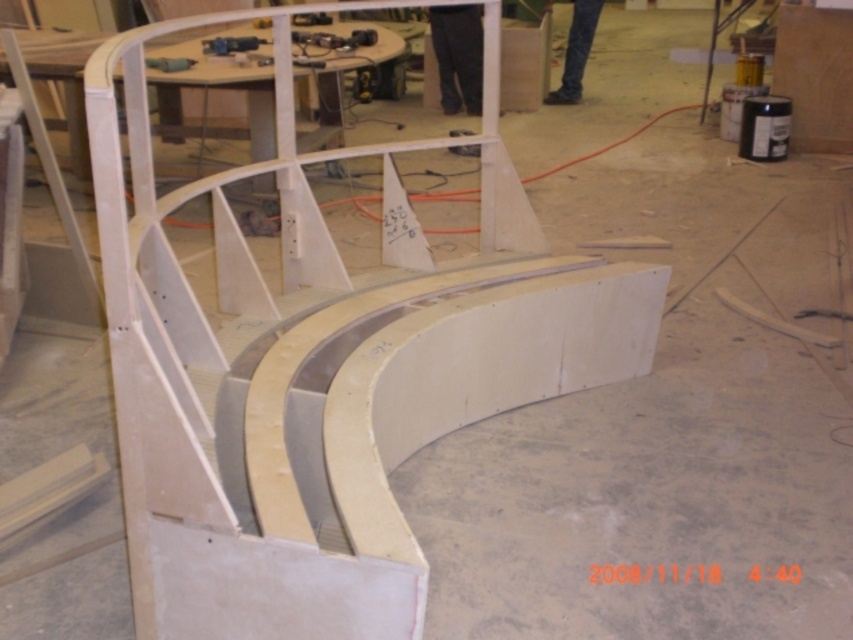
You are a worker in the workshop and need to retrieve the metallic gray drill at upper center. However, there are blue jeans at center blocking your path. Can you reach the drill without moving the jeans?

The blue jeans at center is located above the metallic gray drill at upper center, so the jeans are not blocking the path. You can reach the drill without moving the jeans.